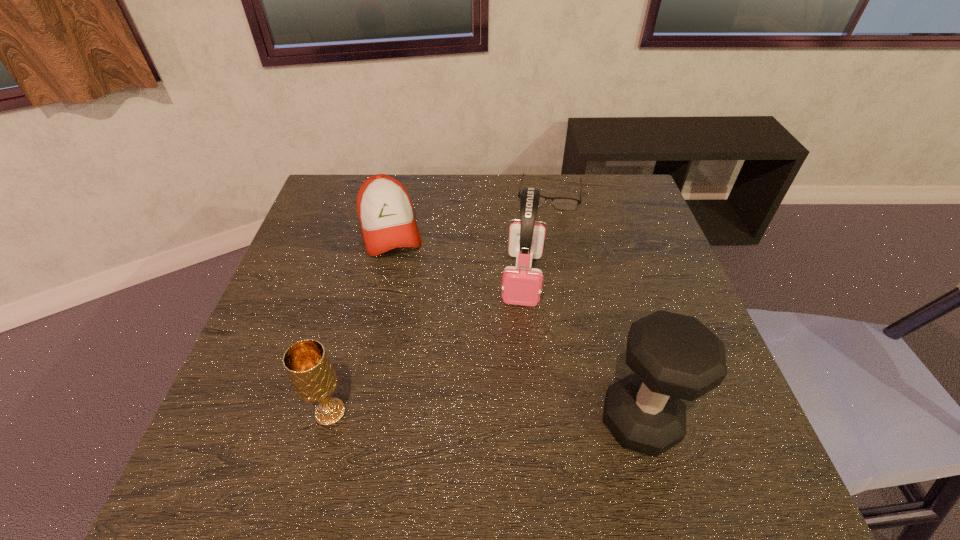
Point out which object is positioned as the nearest to the baseball cap. Please provide its 2D coordinates. Your answer should be formatted as a tuple, i.e. [(x, y)], where the tuple contains the x and y coordinates of a point satisfying the conditions above.

[(522, 286)]

Where is `free spot that satisfies the following two spatial constraints: 1. on the front side of the dumbbell; 2. on the right side of the baseball cap`? free spot that satisfies the following two spatial constraints: 1. on the front side of the dumbbell; 2. on the right side of the baseball cap is located at coordinates (347, 421).

Image resolution: width=960 pixels, height=540 pixels. What are the coordinates of `vacant region that satisfies the following two spatial constraints: 1. on the back side of the shortest object; 2. on the right side of the chalice` in the screenshot? It's located at (387, 193).

What are the coordinates of `vacant space that satisfies the following two spatial constraints: 1. on the back side of the spectacles; 2. on the right side of the second shortest object` in the screenshot? It's located at (398, 193).

This screenshot has width=960, height=540. I want to click on vacant region that satisfies the following two spatial constraints: 1. on the front side of the dumbbell; 2. on the left side of the baseball cap, so click(347, 421).

Find the location of `vacant space that satisfies the following two spatial constraints: 1. on the back side of the spectacles; 2. on the right side of the baseball cap`. vacant space that satisfies the following two spatial constraints: 1. on the back side of the spectacles; 2. on the right side of the baseball cap is located at coordinates (398, 193).